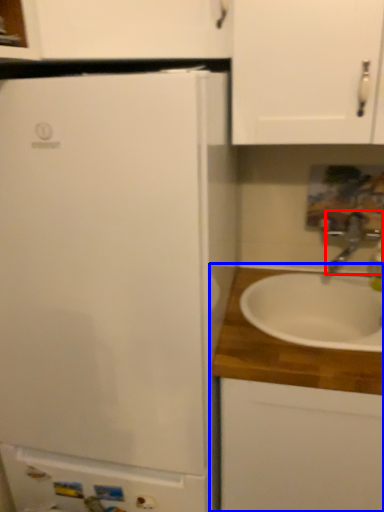
Question: Which object is closer to the camera taking this photo, tap (highlighted by a red box) or cabinetry (highlighted by a blue box)?

Choices:
 (A) tap
 (B) cabinetry

Answer: (B)